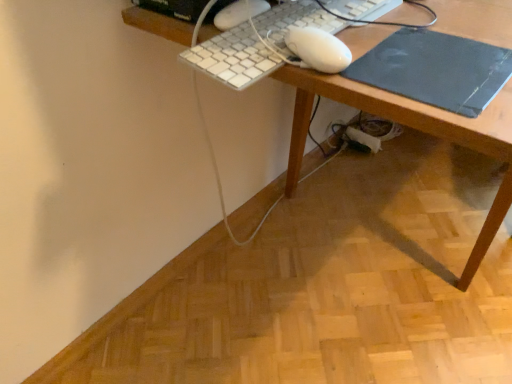
Question: Is wooden desk at center at the back of white plastic keyboard at upper center?

Choices:
 (A) yes
 (B) no

Answer: (B)

Question: Considering the relative positions of white plastic keyboard at upper center and wooden desk at center in the image provided, is white plastic keyboard at upper center in front of wooden desk at center?

Choices:
 (A) yes
 (B) no

Answer: (B)

Question: From a real-world perspective, is white plastic keyboard at upper center positioned over wooden desk at center based on gravity?

Choices:
 (A) no
 (B) yes

Answer: (B)

Question: Is white plastic keyboard at upper center smaller than wooden desk at center?

Choices:
 (A) yes
 (B) no

Answer: (A)

Question: Considering the relative positions of white plastic keyboard at upper center and wooden desk at center in the image provided, is white plastic keyboard at upper center to the left of wooden desk at center from the viewer's perspective?

Choices:
 (A) no
 (B) yes

Answer: (B)

Question: Is wooden desk at center in front of or behind black matte mousepad at right in the image?

Choices:
 (A) front
 (B) behind

Answer: (A)

Question: From their relative heights in the image, would you say wooden desk at center is taller or shorter than black matte mousepad at right?

Choices:
 (A) tall
 (B) short

Answer: (A)

Question: From a real-world perspective, is wooden desk at center physically located above or below black matte mousepad at right?

Choices:
 (A) below
 (B) above

Answer: (A)

Question: Looking at their shapes, would you say wooden desk at center is wider or thinner than black matte mousepad at right?

Choices:
 (A) wide
 (B) thin

Answer: (A)

Question: Would you say wooden desk at center is inside or outside white plastic keyboard at upper center?

Choices:
 (A) outside
 (B) inside

Answer: (A)

Question: Considering the positions of point (411, 102) and point (270, 71), is point (411, 102) closer or farther from the camera than point (270, 71)?

Choices:
 (A) closer
 (B) farther

Answer: (A)

Question: From a real-world perspective, is wooden desk at center positioned above or below white plastic keyboard at upper center?

Choices:
 (A) above
 (B) below

Answer: (B)

Question: Considering the positions of wooden desk at center and white plastic keyboard at upper center in the image, is wooden desk at center wider or thinner than white plastic keyboard at upper center?

Choices:
 (A) wide
 (B) thin

Answer: (A)

Question: Is black matte mousepad at right inside or outside of wooden desk at center?

Choices:
 (A) inside
 (B) outside

Answer: (A)

Question: In the image, is black matte mousepad at right on the left side or the right side of wooden desk at center?

Choices:
 (A) left
 (B) right

Answer: (A)